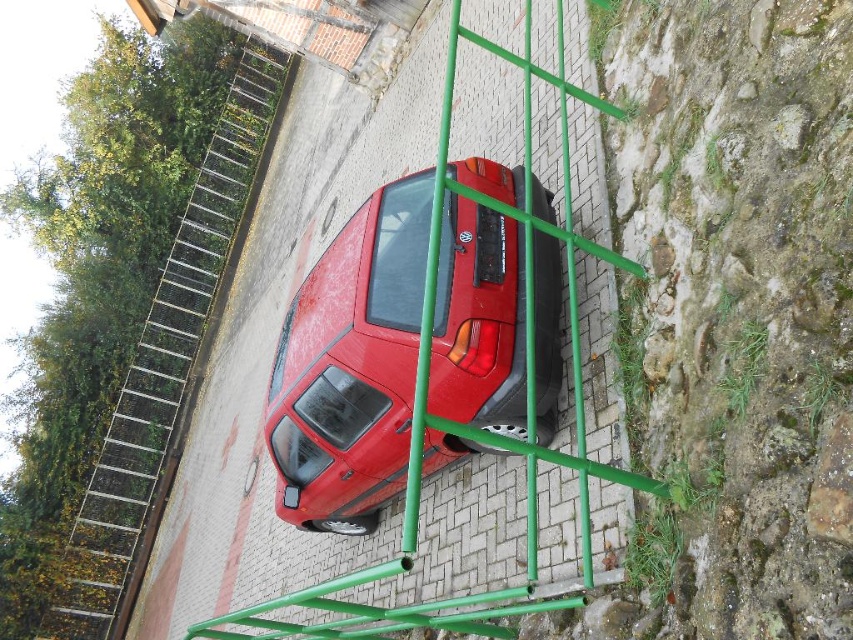
You are standing in the parking lot and see the glossy red car at center and the metallic silver ladder at upper left. Which object is positioned to the right side of the other?

The glossy red car at center is to the right of metallic silver ladder at upper left.

You are standing at the camera position and want to throw a ball to a friend standing at point (578, 392). If the ball can travel up to 4 meters, will it reach your friend?

The distance of point (578, 392) from camera is 4.24 meters, so the ball cannot reach your friend as it requires traveling 4.24 meters but can only go 4 meters.

You are a painter needing to reach a high window. You see a green metal ladder at center and a metallic silver ladder at upper left. Which ladder is closer to the ground?

The green metal ladder at center is positioned under the metallic silver ladder at upper left, so the green metal ladder at center is closer to the ground.